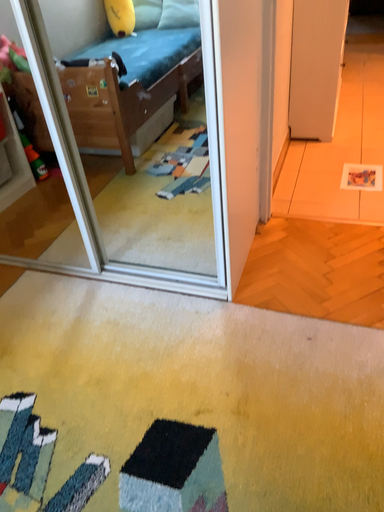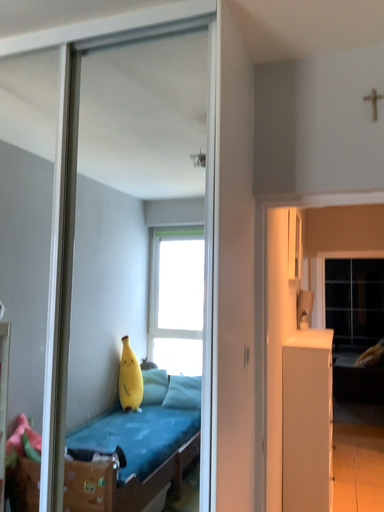
Question: How did the camera likely rotate when shooting the video?

Choices:
 (A) rotated downward
 (B) rotated upward

Answer: (B)